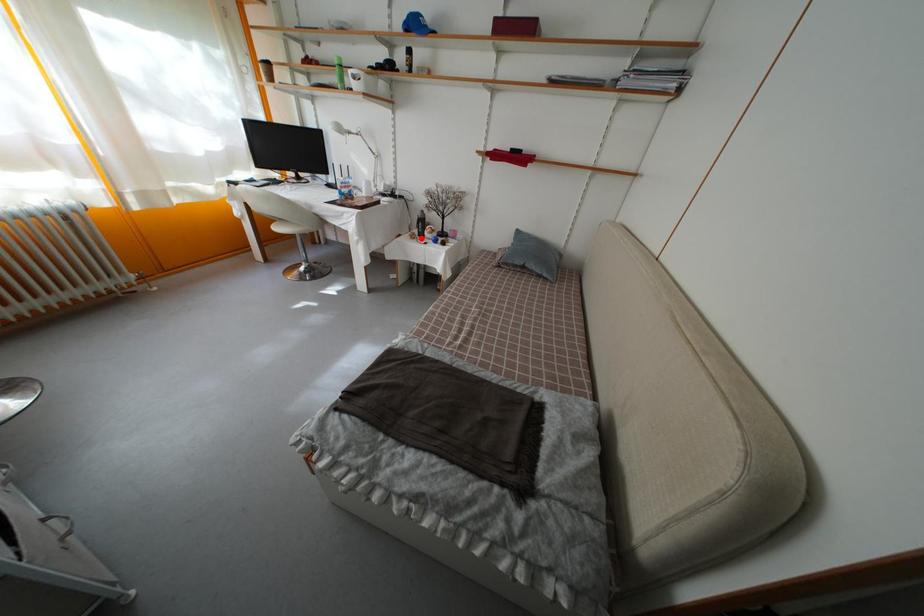
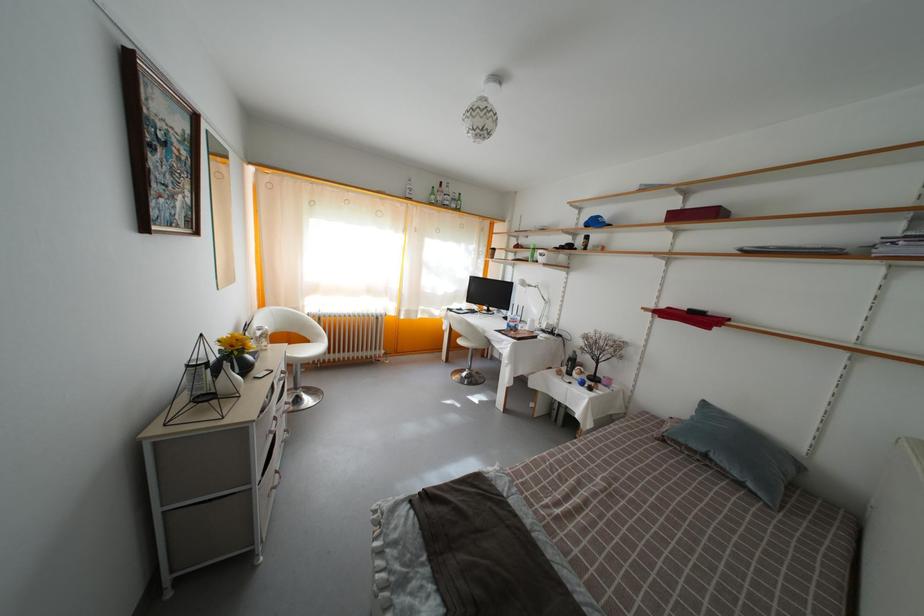
Locate, in the second image, the point that corresponds to the highlighted location in the first image.

(569, 376)